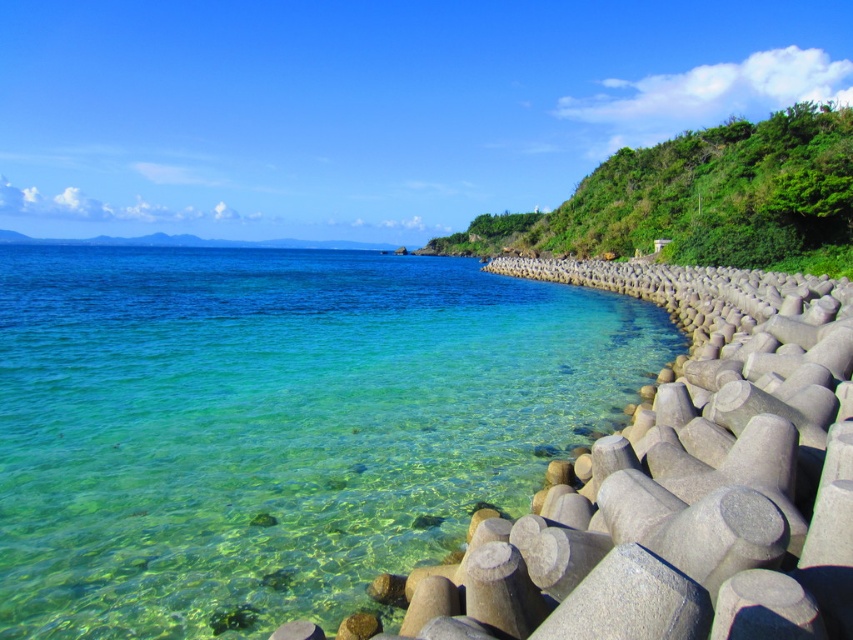
Does point (276, 625) come in front of point (653, 163)?

Yes, it is in front of point (653, 163).

Between clear water at lower left and green leafy hillside at upper right, which one appears on the left side from the viewer's perspective?

clear water at lower left

Who is more forward, (235, 272) or (631, 212)?

Point (235, 272) is more forward.

Where is `clear water at lower left`? This screenshot has height=640, width=853. clear water at lower left is located at coordinates (276, 426).